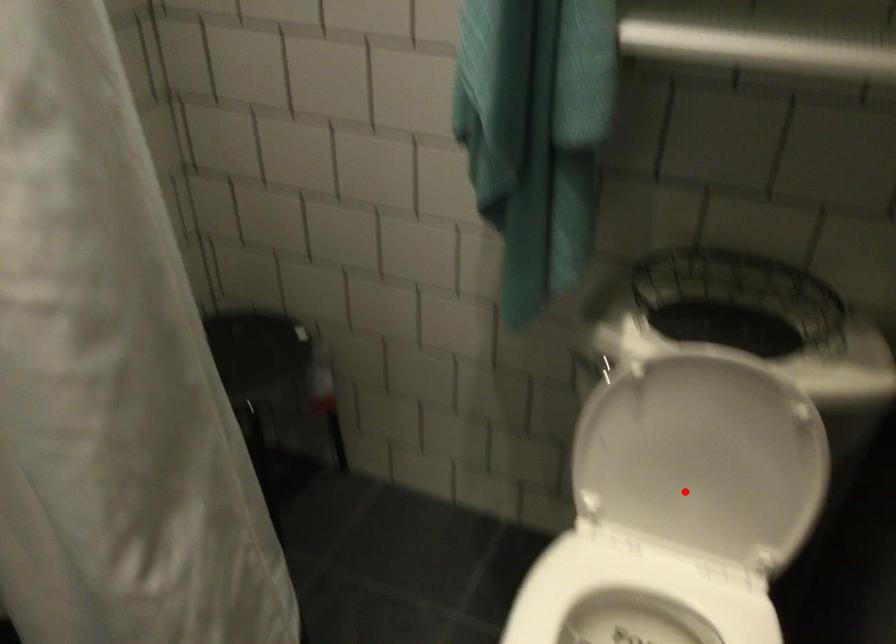
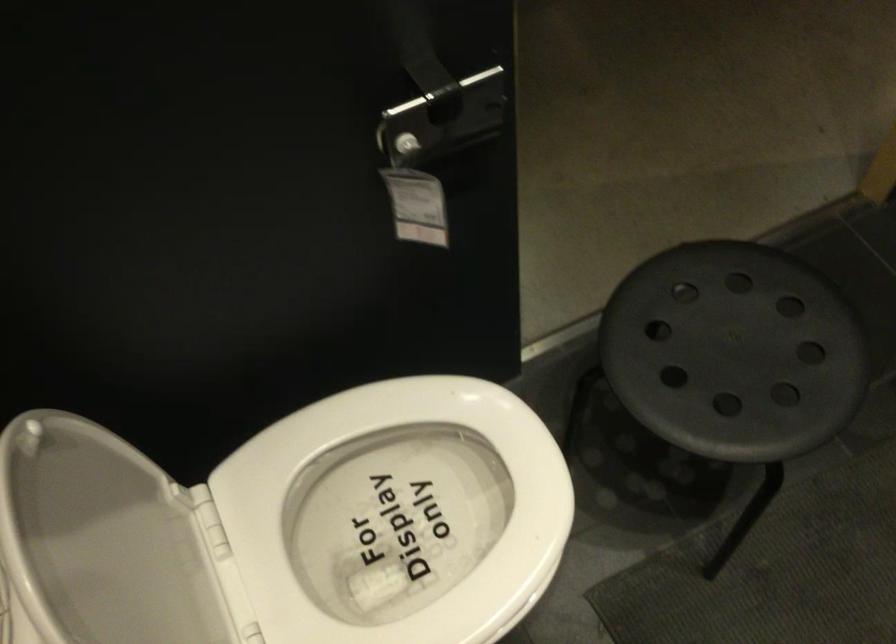
Find the pixel in the second image that matches the highlighted location in the first image.

(100, 540)